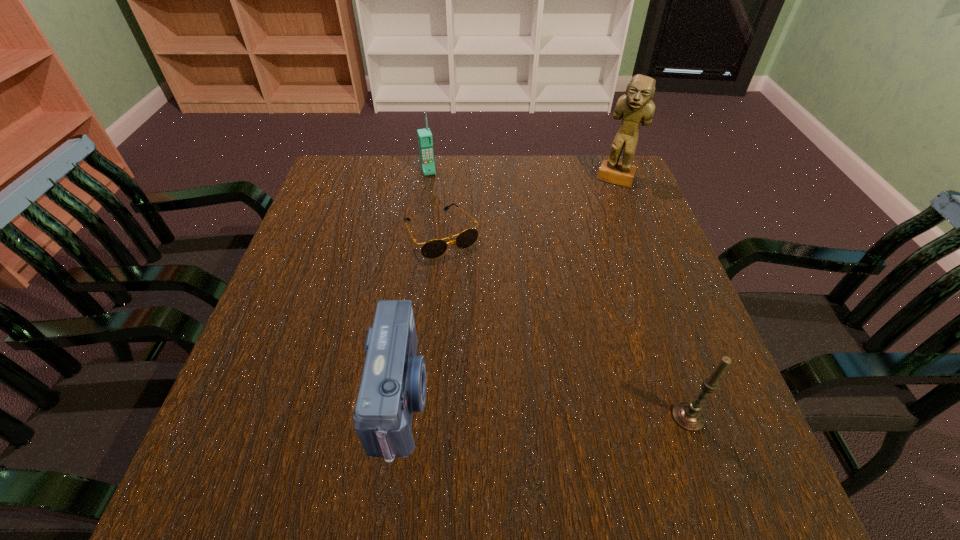
The width and height of the screenshot is (960, 540). I want to click on vacant space on the desktop that is between the camera and the candle and is positioned on the keypad of the cellular telephone, so click(x=513, y=405).

Image resolution: width=960 pixels, height=540 pixels. What are the coordinates of `free space on the desktop that is between the camera and the candle and is positioned on the front-facing side of the third farthest object` in the screenshot? It's located at (553, 408).

Where is `vacant spot on the desktop that is between the camera and the candle and is positioned on the front-facing side of the tallest object`? vacant spot on the desktop that is between the camera and the candle and is positioned on the front-facing side of the tallest object is located at coordinates (533, 406).